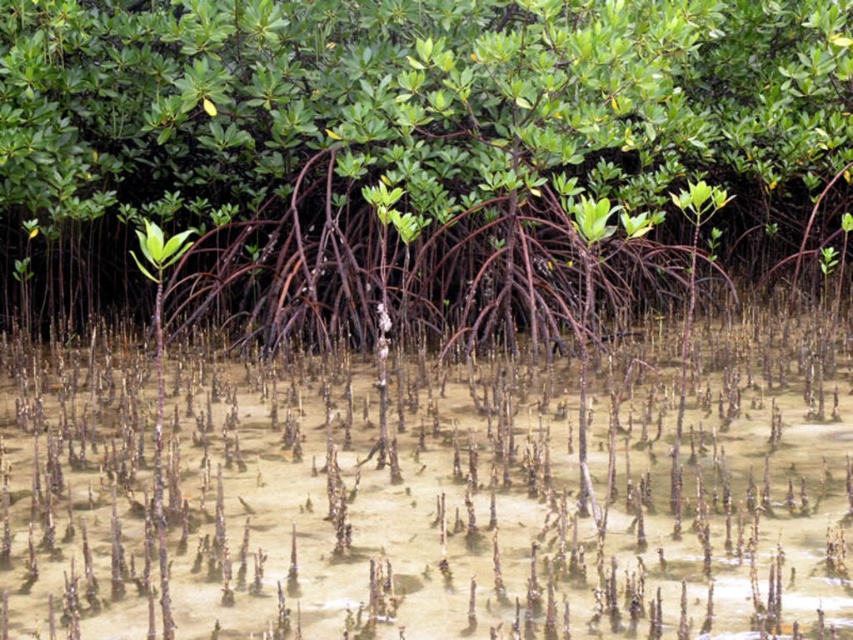
You are standing in the mangrove forest and want to cross from the left side to the right side. You see the green matte tree roots at center and the translucent sandy water at center. Which one should you step on to avoid sinking?

You should step on the green matte tree roots at center because they are solid roots, while the translucent sandy water at center might be soft and could cause sinking.

Based on the scene description, where would you find the green matte tree roots at center in terms of their 2D coordinates?

The green matte tree roots at center are located at the 2D coordinates of point (413, 154).

You are a marine biologist studying mangrove ecosystems. You observe the green matte tree roots at center and the translucent sandy water at center in the image. Which object occupies a greater area in the scene?

The green matte tree roots at center is larger in size than the translucent sandy water at center, so the green matte tree roots at center occupies a greater area in the scene.